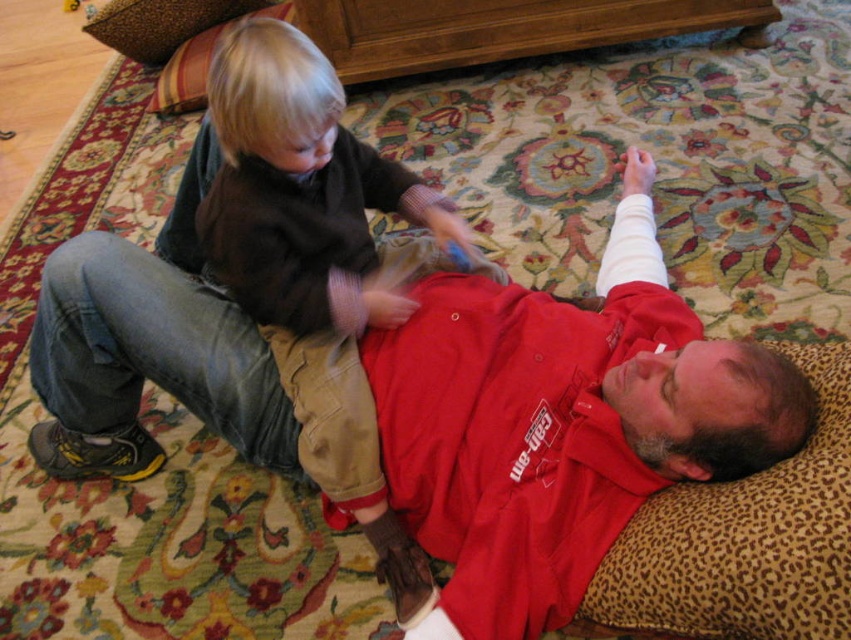
Is point (276, 403) in front of point (271, 296)?

That is False.

Is red matte jacket at upper center closer to camera compared to matte brown sweater at upper left?

Yes, red matte jacket at upper center is closer to the viewer.

You are a GUI agent. You are given a task and a screenshot of the screen. Output one action in this format:
    pyautogui.click(x=<x>, y=<y>)
    Task: Click on the red matte jacket at upper center
    The width and height of the screenshot is (851, 640).
    Given the screenshot: What is the action you would take?
    pyautogui.click(x=433, y=404)